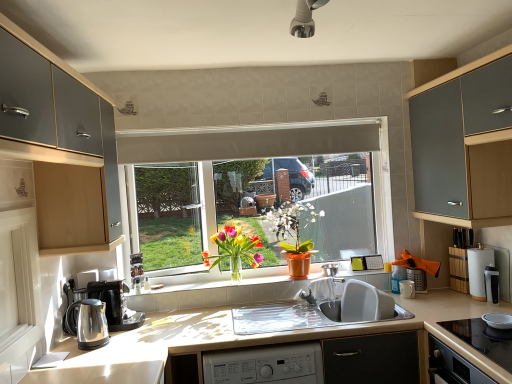
Locate an element on the screen. The image size is (512, 384). orange matte pot at center, the 1th floral arrangement viewed from the right is located at coordinates (292, 225).

This screenshot has width=512, height=384. What do you see at coordinates (292, 225) in the screenshot?
I see `orange matte pot at center, the 1th floral arrangement viewed from the right` at bounding box center [292, 225].

I want to click on matte white window at center, so click(x=264, y=190).

You are a GUI agent. You are given a task and a screenshot of the screen. Output one action in this format:
    pyautogui.click(x=<x>, y=<y>)
    Task: Click on the white matte exhaust hood at center
    
    Given the screenshot: What is the action you would take?
    pyautogui.click(x=247, y=143)

Between matte gray cabinet at upper right, the 1th cabinetry in the right-to-left sequence, and black glass cooktop at lower right, which one is positioned in front?

black glass cooktop at lower right is in front.

Based on the photo, does matte gray cabinet at upper right, the second cabinetry when ordered from left to right, have a greater height compared to black glass cooktop at lower right?

Yes.

From a real-world perspective, is matte gray cabinet at upper right, the 1th cabinetry in the right-to-left sequence, under black glass cooktop at lower right?

No, from a real-world perspective, matte gray cabinet at upper right, the 1th cabinetry in the right-to-left sequence, is not beneath black glass cooktop at lower right.

Considering the relative positions of matte gray cabinet at upper right, the second cabinetry when ordered from left to right, and black glass cooktop at lower right in the image provided, is matte gray cabinet at upper right, the second cabinetry when ordered from left to right, to the left of black glass cooktop at lower right from the viewer's perspective?

No, matte gray cabinet at upper right, the second cabinetry when ordered from left to right, is not to the left of black glass cooktop at lower right.

Between orange matte pot at center, the 1th floral arrangement viewed from the right, and metallic silver pot at center, the 1th appliance when ordered from back to front, which one has larger width?

orange matte pot at center, the 1th floral arrangement viewed from the right, is wider.

Are orange matte pot at center, the 1th floral arrangement viewed from the right, and metallic silver pot at center, placed as the 1th appliance when sorted from left to right, making contact?

They are not placed beside each other.

In terms of size, does orange matte pot at center, the 1th floral arrangement viewed from the right, appear bigger or smaller than metallic silver pot at center, the 5th appliance from the right?

orange matte pot at center, the 1th floral arrangement viewed from the right, is bigger than metallic silver pot at center, the 5th appliance from the right.

Could you tell me if orange matte pot at center, the 1th floral arrangement viewed from the right, is facing metallic silver pot at center, the 5th appliance from the right?

No, orange matte pot at center, the 1th floral arrangement viewed from the right, does not turn towards metallic silver pot at center, the 5th appliance from the right.

Between translucent glass vase at center, the 2th floral arrangement in the right-to-left sequence, and matte white window at center, which one is positioned in front?

translucent glass vase at center, the 2th floral arrangement in the right-to-left sequence.

From the image's perspective, is translucent glass vase at center, the 2th floral arrangement in the right-to-left sequence, positioned above or below matte white window at center?

translucent glass vase at center, the 2th floral arrangement in the right-to-left sequence, is below matte white window at center.

Is translucent glass vase at center, the 1th floral arrangement in the left-to-right sequence, bigger or smaller than matte white window at center?

translucent glass vase at center, the 1th floral arrangement in the left-to-right sequence, is smaller than matte white window at center.

Is translucent glass vase at center, the 2th floral arrangement in the right-to-left sequence, touching matte white window at center?

There is a gap between translucent glass vase at center, the 2th floral arrangement in the right-to-left sequence, and matte white window at center.

Does metallic silver pot at center, the 5th appliance from the right, have a smaller size compared to white glossy screen door at left?

Indeed, metallic silver pot at center, the 5th appliance from the right, has a smaller size compared to white glossy screen door at left.

From a real-world perspective, is metallic silver pot at center, the 5th appliance from the right, over white glossy screen door at left?

No, from a real-world perspective, metallic silver pot at center, the 5th appliance from the right, is not on top of white glossy screen door at left.

Which is more to the left, metallic silver pot at center, the 1th appliance when ordered from back to front, or white glossy screen door at left?

white glossy screen door at left is more to the left.

Between metallic silver pot at center, placed as the 1th appliance when sorted from left to right, and white glossy screen door at left, which one has larger width?

Wider between the two is white glossy screen door at left.

Is white ceramic mug at right, the fourth appliance positioned from the right, facing away from metallic silver pot at center, the 1th appliance when ordered from back to front?

No, metallic silver pot at center, the 1th appliance when ordered from back to front, is not at the back of white ceramic mug at right, the fourth appliance positioned from the right.

You are a GUI agent. You are given a task and a screenshot of the screen. Output one action in this format:
    pyautogui.click(x=<x>, y=<y>)
    Task: Click on the appliance that is the 2nd one above the white ceramic mug at right, the third appliance from the front (from a real-world perspective)
    The width and height of the screenshot is (512, 384).
    Given the screenshot: What is the action you would take?
    pyautogui.click(x=330, y=269)

Is white ceramic mug at right, the 3th appliance in the back-to-front sequence, touching metallic silver pot at center, the 5th appliance from the right?

white ceramic mug at right, the 3th appliance in the back-to-front sequence, and metallic silver pot at center, the 5th appliance from the right, are clearly separated.

From the image's perspective, which one is positioned higher, white ceramic mug at right, the third appliance from the front, or metallic silver pot at center, placed as the 1th appliance when sorted from left to right?

metallic silver pot at center, placed as the 1th appliance when sorted from left to right, appears higher in the image.

Which is more to the left, metallic silver pot at center, the 5th appliance from the front, or black glass cooktop at lower right?

Positioned to the left is metallic silver pot at center, the 5th appliance from the front.

Can you confirm if metallic silver pot at center, placed as the 1th appliance when sorted from left to right, is wider than black glass cooktop at lower right?

Incorrect, the width of metallic silver pot at center, placed as the 1th appliance when sorted from left to right, does not surpass that of black glass cooktop at lower right.

From the image's perspective, is metallic silver pot at center, the 5th appliance from the right, located above or below black glass cooktop at lower right?

Based on their image positions, metallic silver pot at center, the 5th appliance from the right, is located above black glass cooktop at lower right.

Looking at this image, is there a large distance between orange matte pot at center, which appears as the second floral arrangement when viewed from the left, and white matte exhaust hood at center?

orange matte pot at center, which appears as the second floral arrangement when viewed from the left, is actually quite close to white matte exhaust hood at center.

Considering the relative positions of orange matte pot at center, which appears as the second floral arrangement when viewed from the left, and white matte exhaust hood at center in the image provided, is orange matte pot at center, which appears as the second floral arrangement when viewed from the left, to the right of white matte exhaust hood at center from the viewer's perspective?

Correct, you'll find orange matte pot at center, which appears as the second floral arrangement when viewed from the left, to the right of white matte exhaust hood at center.

Is orange matte pot at center, the 1th floral arrangement viewed from the right, oriented away from white matte exhaust hood at center?

No, orange matte pot at center, the 1th floral arrangement viewed from the right, is not facing the opposite direction of white matte exhaust hood at center.

Measure the distance between orange matte pot at center, which appears as the second floral arrangement when viewed from the left, and white matte exhaust hood at center.

orange matte pot at center, which appears as the second floral arrangement when viewed from the left, and white matte exhaust hood at center are 54.55 centimeters apart from each other.

Identify the location of gas stove that appears below the matte gray cabinet at upper right, the second cabinetry when ordered from left to right (from the image's perspective). (484, 339).

From a real-world perspective, which appliance is the 2nd one underneath the orange matte pot at center, which appears as the second floral arrangement when viewed from the left? Please provide its 2D coordinates.

[(330, 269)]

Based on their spatial positions, is matte silver utensil holder at right, marked as the 4th appliance in a front-to-back arrangement, or matte gray cabinet at upper right, the 1th cabinetry in the right-to-left sequence, further from black ceramic bowl at lower right, the 4th appliance from the left?

The object further to black ceramic bowl at lower right, the 4th appliance from the left, is matte gray cabinet at upper right, the 1th cabinetry in the right-to-left sequence.

In the scene shown: When comparing their distances from brushed metal cabinet at left, positioned as the first cabinetry in left-to-right order, does white paper towel at right, arranged as the 5th appliance when viewed from the left, or matte silver utensil holder at right, the third appliance when ordered from left to right, seem further?

A: white paper towel at right, arranged as the 5th appliance when viewed from the left, is further to brushed metal cabinet at left, positioned as the first cabinetry in left-to-right order.

Considering their positions, is matte white window at center positioned further to black glass cooktop at lower right than white matte exhaust hood at center?

Among the two, white matte exhaust hood at center is located further to black glass cooktop at lower right.

From the image, which object appears to be farther from shiny black coffee machine at left, brushed metal cabinet at left, the second cabinetry positioned from the right, or polished stainless steel kettle at lower left?

brushed metal cabinet at left, the second cabinetry positioned from the right, is further to shiny black coffee machine at left.

When comparing their distances from translucent glass vase at center, the 1th floral arrangement in the left-to-right sequence, does brushed metal cabinet at left, positioned as the first cabinetry in left-to-right order, or matte white window at center seem further?

brushed metal cabinet at left, positioned as the first cabinetry in left-to-right order, is positioned further to the anchor translucent glass vase at center, the 1th floral arrangement in the left-to-right sequence.

When comparing their distances from orange matte pot at center, which appears as the second floral arrangement when viewed from the left, does brushed metal cabinet at left, the second cabinetry positioned from the right, or black glass cooktop at lower right seem closer?

black glass cooktop at lower right is positioned closer to the anchor orange matte pot at center, which appears as the second floral arrangement when viewed from the left.

From the image, which object appears to be farther from white paper towel at right, the fourth appliance viewed from the back, white ceramic mug at right, the fourth appliance positioned from the right, or matte silver utensil holder at right, the second appliance in the back-to-front sequence?

white ceramic mug at right, the fourth appliance positioned from the right.

Estimate the real-world distances between objects in this image. Which object is further from black glass cooktop at lower right, white ceramic mug at right, the fourth appliance positioned from the right, or shiny black coffee machine at left?

shiny black coffee machine at left is further to black glass cooktop at lower right.

Locate an element on the screen. window between white matte exhaust hood at center and matte gray cabinet at upper right, the second cabinetry when ordered from left to right is located at coordinates (264, 190).

I want to click on window located between polished stainless steel kettle at lower left and matte gray cabinet at upper right, the 1th cabinetry in the right-to-left sequence, in the left-right direction, so click(264, 190).

Locate an element on the screen. The image size is (512, 384). window sill situated between white matte exhaust hood at center and white paper towel at right, arranged as the 5th appliance when viewed from the left, from left to right is located at coordinates (232, 290).

Where is `gas stove situated between orange matte pot at center, which appears as the second floral arrangement when viewed from the left, and black ceramic bowl at lower right, which is the first appliance in front-to-back order, from left to right`? The height and width of the screenshot is (384, 512). gas stove situated between orange matte pot at center, which appears as the second floral arrangement when viewed from the left, and black ceramic bowl at lower right, which is the first appliance in front-to-back order, from left to right is located at coordinates (484, 339).